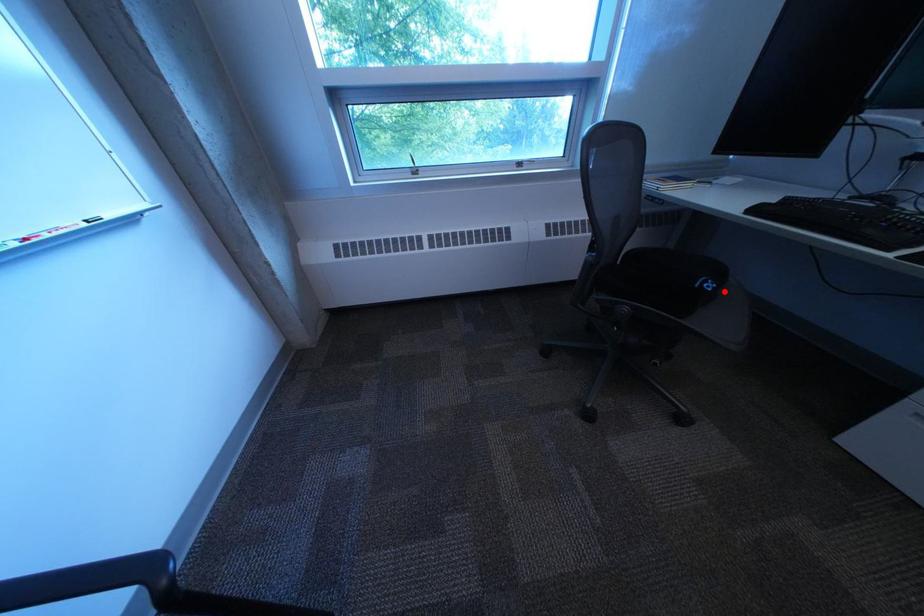
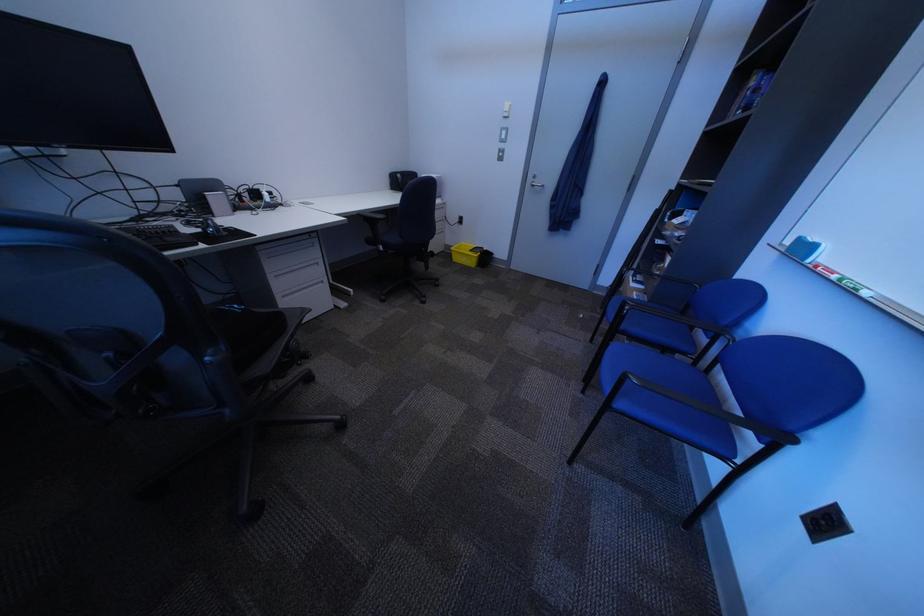
Where in the second image is the point corresponding to the highlighted location from the first image?

(259, 309)